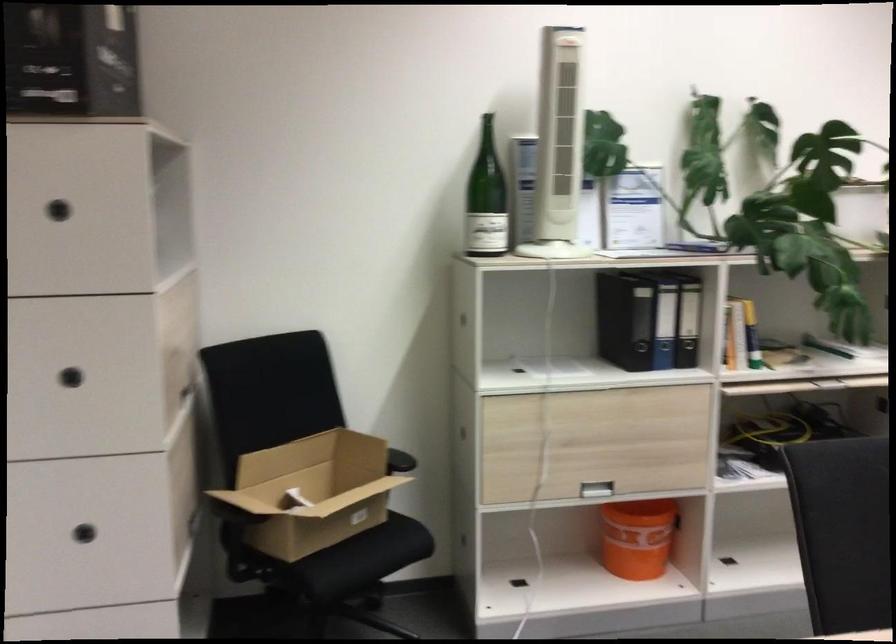
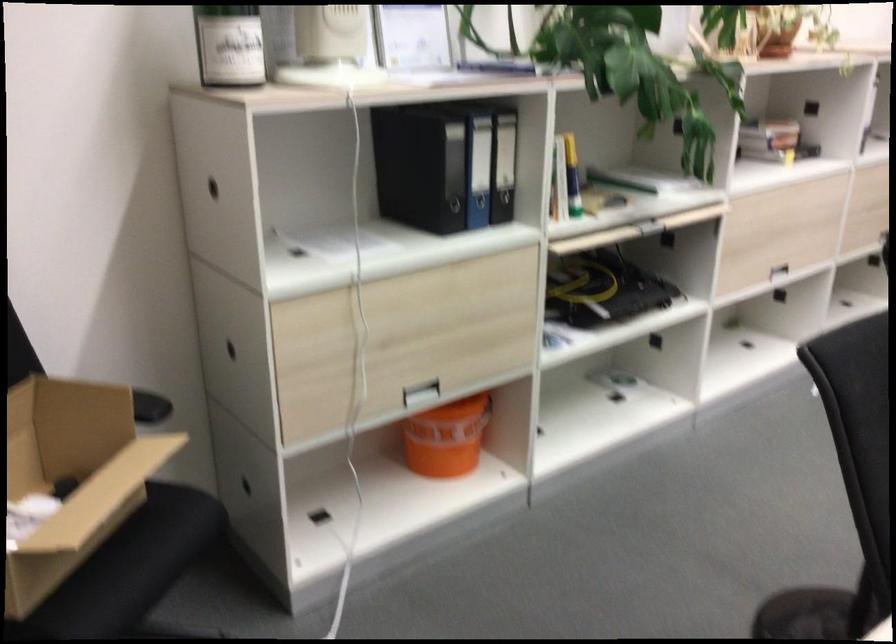
In the second image, find the point that corresponds to point (626, 536) in the first image.

(446, 438)